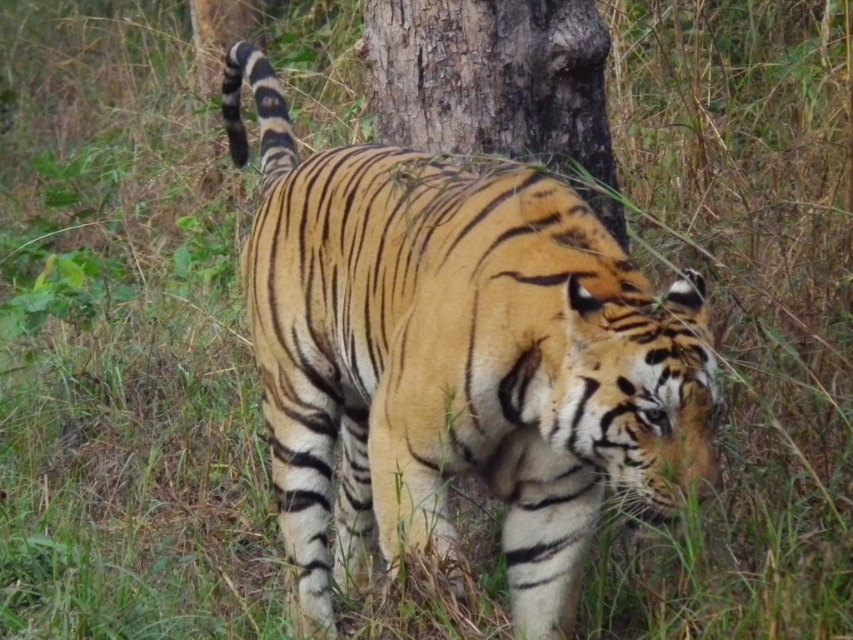
Does orange-yellow fur tiger at center have a greater height compared to rough bark tree at center?

Indeed, orange-yellow fur tiger at center has a greater height compared to rough bark tree at center.

Between point (566, 467) and point (503, 26), which one is positioned behind?

Positioned behind is point (503, 26).

Where is `orange-yellow fur tiger at center`? Image resolution: width=853 pixels, height=640 pixels. orange-yellow fur tiger at center is located at coordinates (456, 358).

Locate an element on the screen. orange-yellow fur tiger at center is located at coordinates (456, 358).